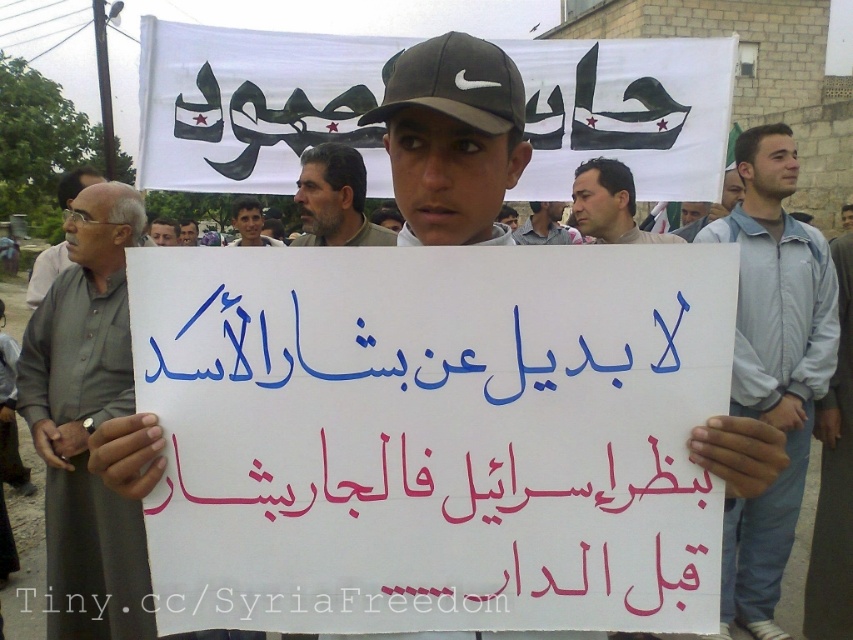
You are a photographer standing in front of the protest scene. You want to take a photo that includes both the gray fabric shirt at left and the smooth beige shirt at center. Which shirt should you focus on first to ensure both are in the frame?

You should focus on the gray fabric shirt at left first because it is closer to the viewer than the smooth beige shirt at center, ensuring both are in the frame.

You are a photographer at the protest scene. You need to capture a photo that includes both the gray hair at center and the light brown skin at center. Given their heights, which subject should you position closer to the camera to ensure both are fully visible in the frame?

Since the gray hair at center is much taller than the light brown skin at center, you should position the light brown skin at center closer to the camera to ensure both are fully visible in the frame.